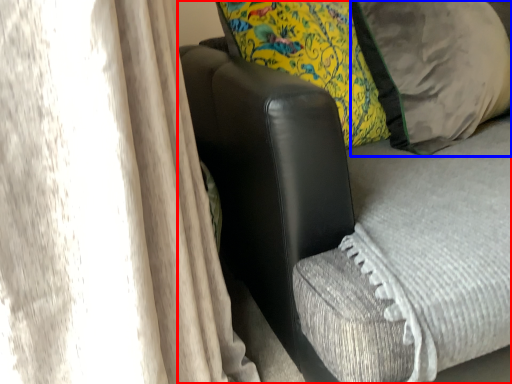
Question: Which object is closer to the camera taking this photo, furniture (highlighted by a red box) or pillow (highlighted by a blue box)?

Choices:
 (A) furniture
 (B) pillow

Answer: (A)